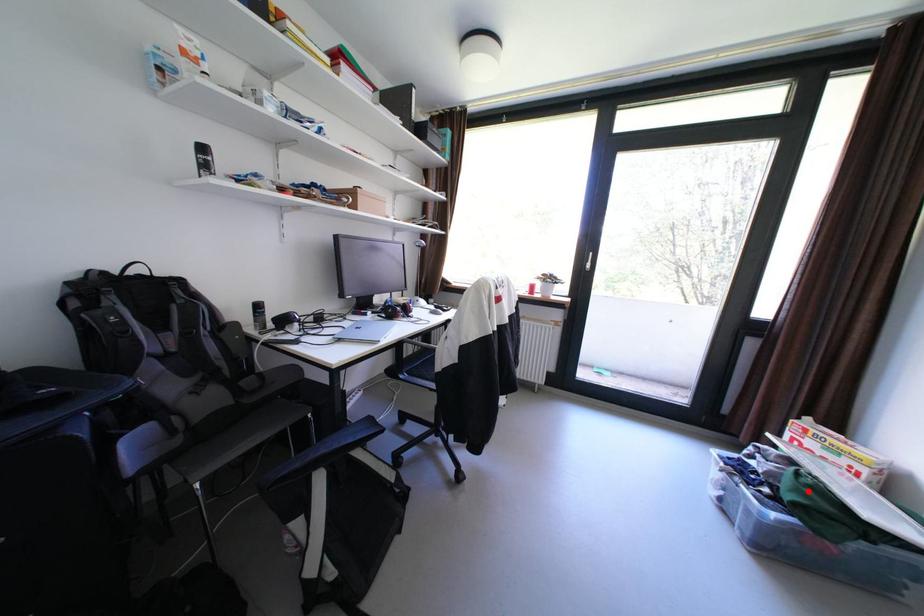
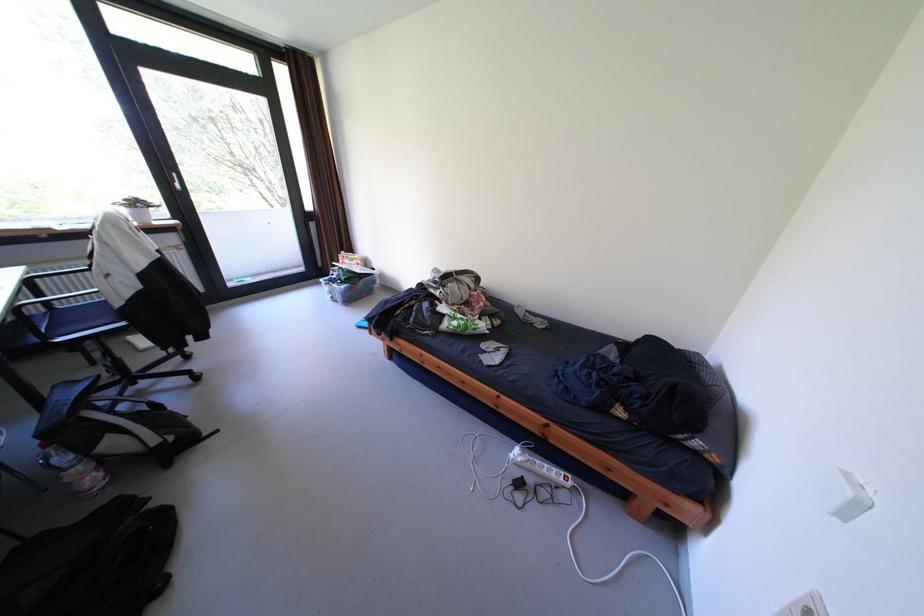
The point at the highlighted location is marked in the first image. Where is the corresponding point in the second image?

(355, 275)